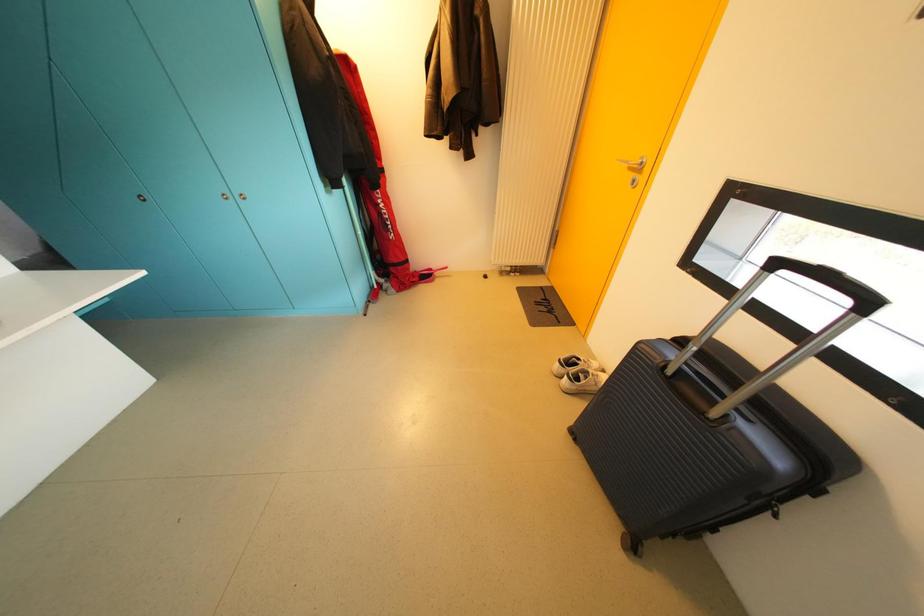
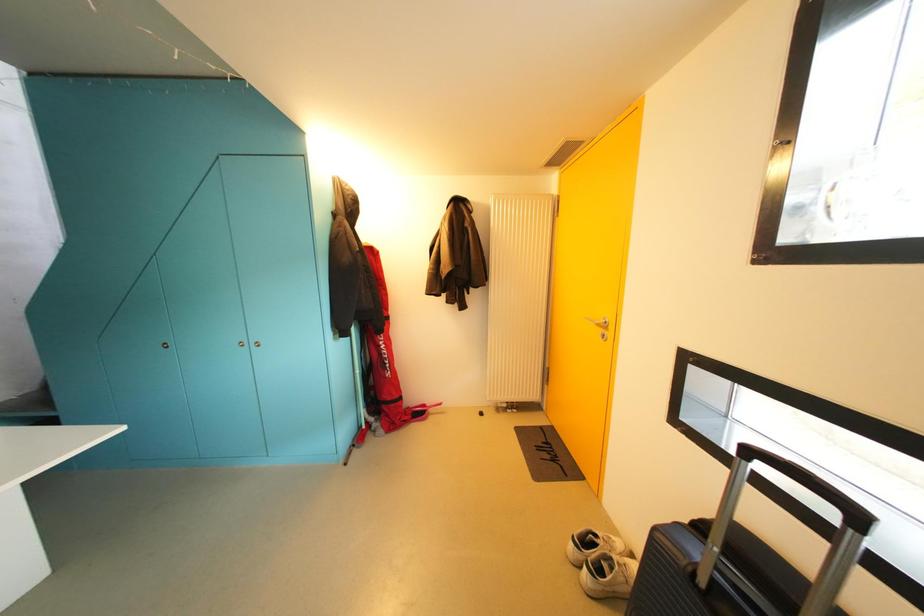
The images are taken continuously from a first-person perspective. In which direction are you moving?

The cameraman walked toward right, backward.